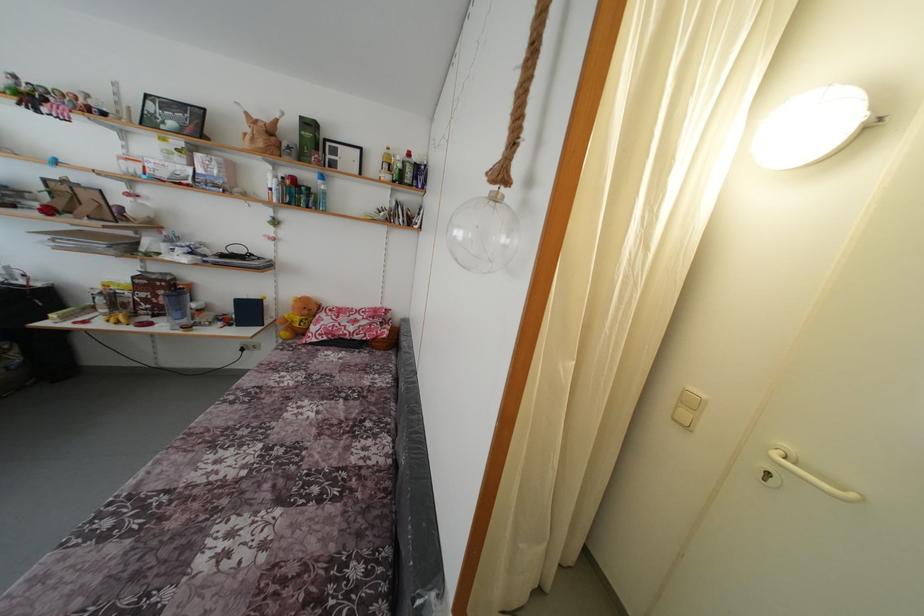
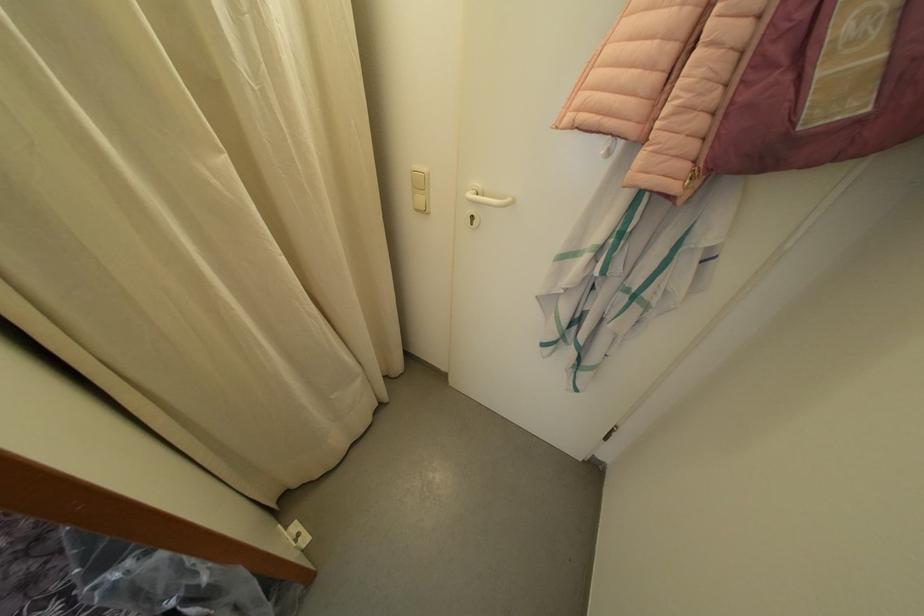
Find the pixel in the second image that matches [698,410] in the first image.

(427, 191)